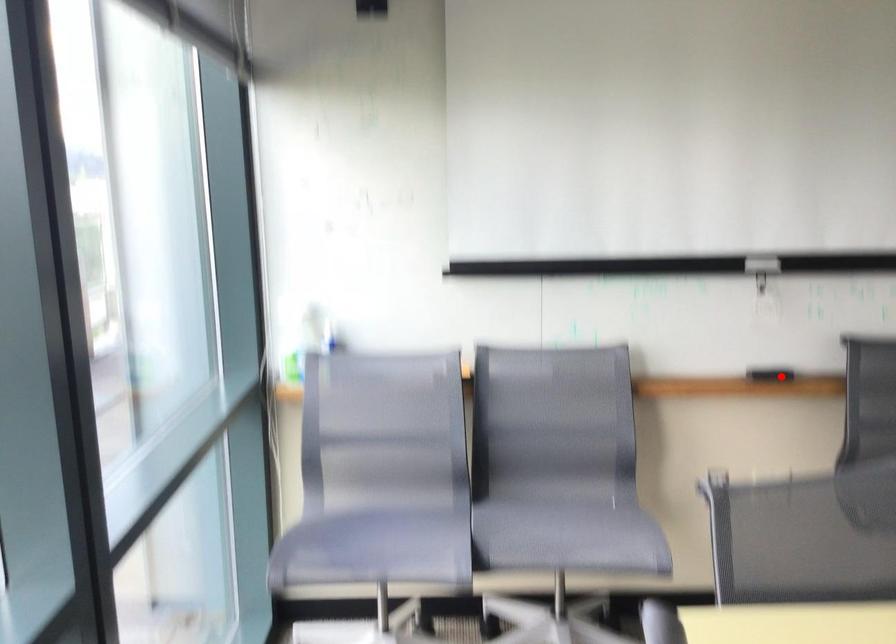
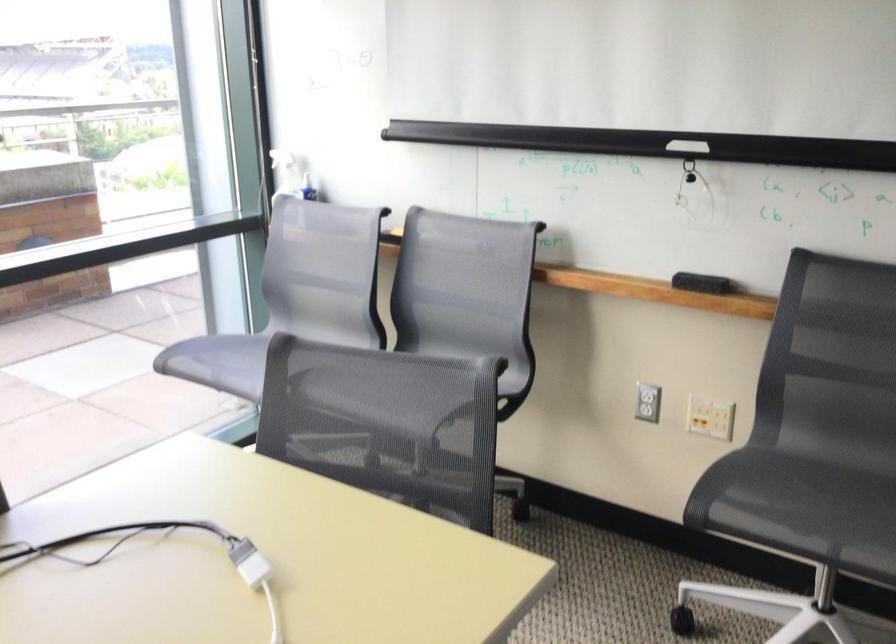
Find the pixel in the second image that matches the highlighted location in the first image.

(701, 283)